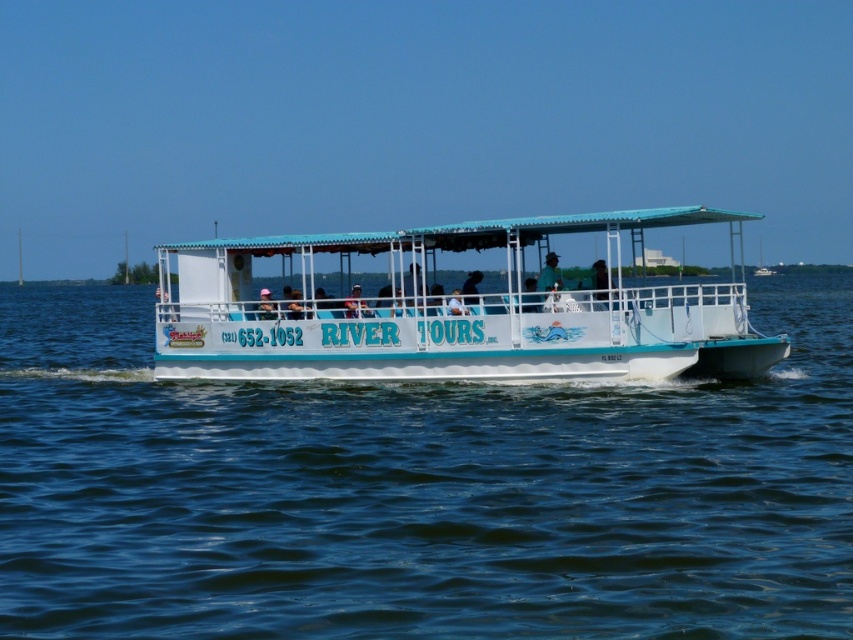
Question: Does black fabric at center appear on the right side of white plastic hat at center?

Choices:
 (A) no
 (B) yes

Answer: (B)

Question: Which point is closer to the camera taking this photo?

Choices:
 (A) click(x=605, y=269)
 (B) click(x=347, y=307)
 (C) click(x=834, y=413)
 (D) click(x=413, y=360)

Answer: (C)

Question: Can you confirm if black fabric at center is positioned below matte white shirt at center?

Choices:
 (A) yes
 (B) no

Answer: (B)

Question: Considering the real-world distances, which object is closest to the white plastic hat at center?

Choices:
 (A) matte white shirt at center
 (B) white matte boat at center
 (C) blue water at center
 (D) blue fabric shirt at center

Answer: (A)

Question: Which point appears farthest from the camera in this image?

Choices:
 (A) (549, 260)
 (B) (335, 316)
 (C) (347, 305)

Answer: (B)

Question: In this image, where is matte white shirt at center located relative to white plastic hat at center?

Choices:
 (A) left
 (B) right

Answer: (B)